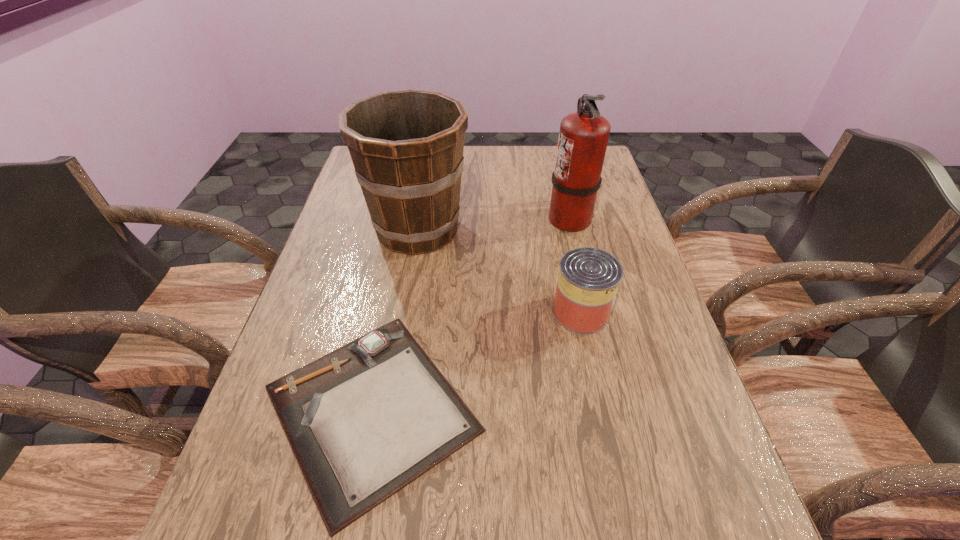
At what (x,y) coordinates should I click in order to perform the action: click on bucket that is at the left edge. Please return your answer as a coordinate pair (x, y). The height and width of the screenshot is (540, 960). Looking at the image, I should click on (407, 146).

This screenshot has height=540, width=960. I want to click on clipboard present at the left edge, so click(x=364, y=421).

What are the coordinates of `fire extinguisher that is at the right edge` in the screenshot? It's located at (583, 137).

Where is `can that is positioned at the right edge`? can that is positioned at the right edge is located at coordinates (588, 280).

You are a GUI agent. You are given a task and a screenshot of the screen. Output one action in this format:
    pyautogui.click(x=<x>, y=<y>)
    Task: Click on the vacant space at the far edge
    This screenshot has height=540, width=960.
    Given the screenshot: What is the action you would take?
    pyautogui.click(x=539, y=151)

The image size is (960, 540). Find the location of `vacant space at the left edge of the desktop`. vacant space at the left edge of the desktop is located at coordinates (231, 501).

In the image, there is a desktop. Where is `vacant space at the right edge`? The image size is (960, 540). vacant space at the right edge is located at coordinates (658, 458).

The image size is (960, 540). Find the location of `free area in between the shortest object and the fire extinguisher`. free area in between the shortest object and the fire extinguisher is located at coordinates [470, 314].

The image size is (960, 540). Find the location of `free spot between the third tallest object and the bucket`. free spot between the third tallest object and the bucket is located at coordinates (499, 271).

This screenshot has width=960, height=540. I want to click on free point between the third shortest object and the shortest object, so click(x=395, y=319).